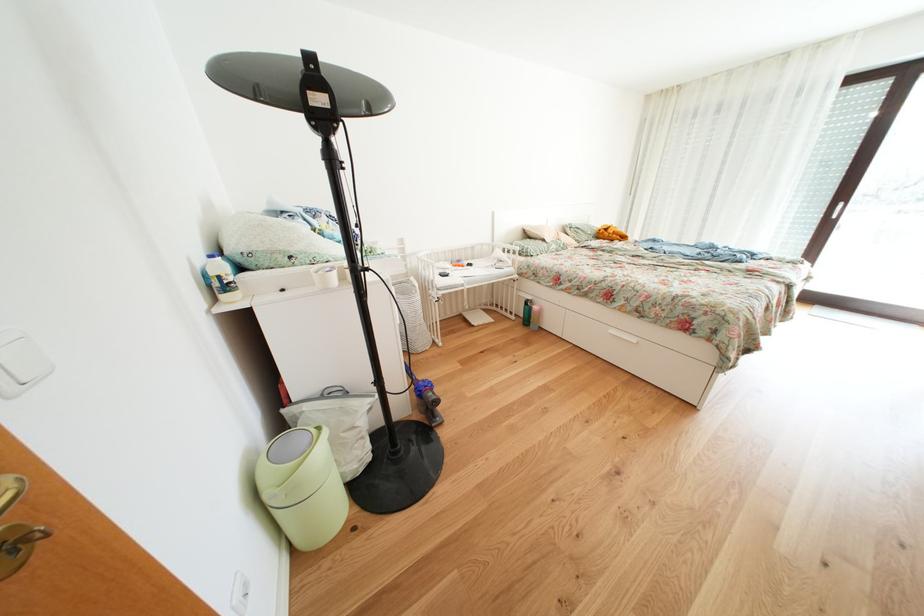
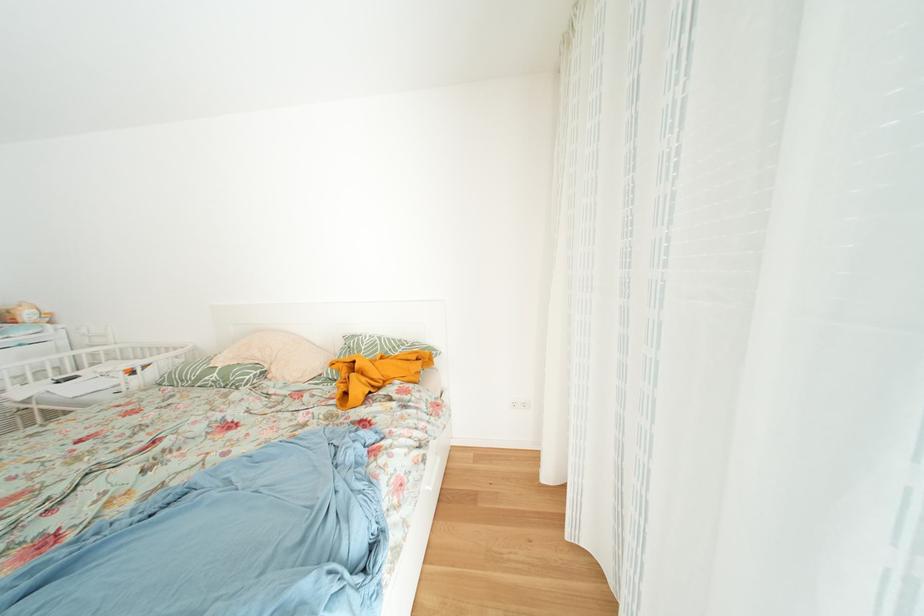
Locate, in the second image, the point that corresponds to (557,254) in the first image.

(208, 384)